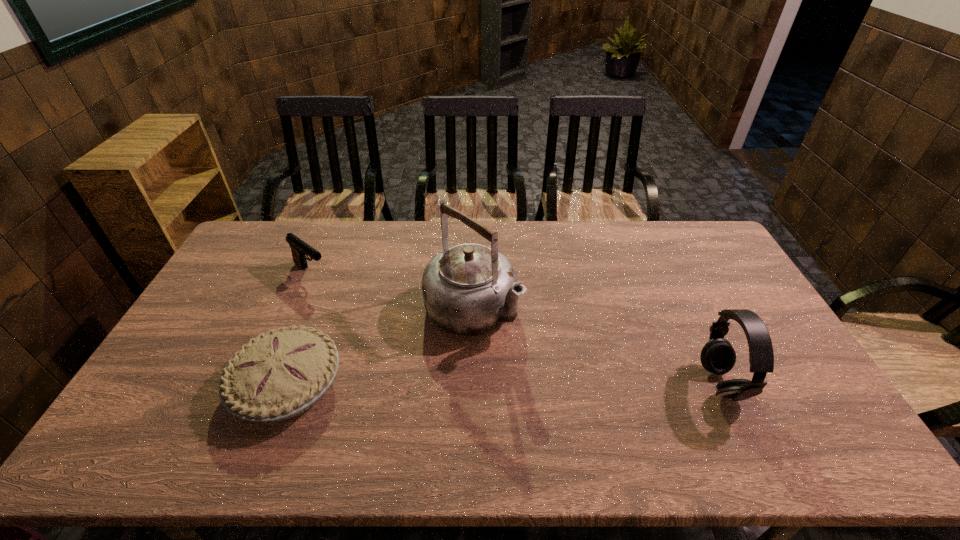
Where is `vacant region located at the barrel of the third tallest object`? This screenshot has height=540, width=960. vacant region located at the barrel of the third tallest object is located at coordinates (366, 312).

At what (x,y) coordinates should I click in order to perform the action: click on free space located at the barrel of the third tallest object. Please return your answer as a coordinate pair (x, y). Looking at the image, I should click on (398, 335).

The width and height of the screenshot is (960, 540). I want to click on vacant space located at the barrel of the third tallest object, so click(387, 327).

Where is `free location located at the spout of the kettle`? This screenshot has height=540, width=960. free location located at the spout of the kettle is located at coordinates (556, 376).

Identify the location of free space located at the spout of the kettle. The height and width of the screenshot is (540, 960). (609, 417).

Identify the location of free space located 0.160m at the spout of the kettle. Image resolution: width=960 pixels, height=540 pixels. pos(547,369).

The height and width of the screenshot is (540, 960). What are the coordinates of `object located at the far edge` in the screenshot? It's located at (299, 248).

You are a GUI agent. You are given a task and a screenshot of the screen. Output one action in this format:
    pyautogui.click(x=<x>, y=<y>)
    Task: Click on the pie that is at the near edge
    The height and width of the screenshot is (540, 960).
    Given the screenshot: What is the action you would take?
    pyautogui.click(x=278, y=375)

The width and height of the screenshot is (960, 540). I want to click on earphone at the near edge, so click(718, 356).

Image resolution: width=960 pixels, height=540 pixels. What are the coordinates of `free space at the far edge of the desktop` in the screenshot? It's located at (659, 248).